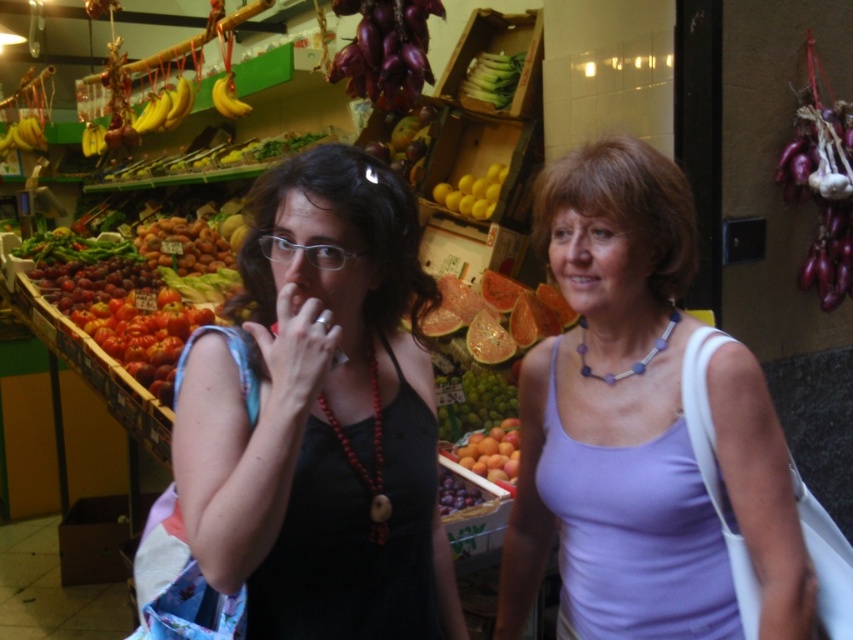
Question: Which of the following is the farthest from the observer?

Choices:
 (A) (218, 88)
 (B) (444, 182)
 (C) (479, 81)

Answer: (A)

Question: Does matte black tank top at center appear under smooth orange peaches at center?

Choices:
 (A) yes
 (B) no

Answer: (B)

Question: Can you confirm if ripe yellow apricots at center is bigger than matte yellow bananas at left?

Choices:
 (A) yes
 (B) no

Answer: (A)

Question: Does purple glossy eggplant at upper center lie in front of yellow matte bananas at upper left?

Choices:
 (A) yes
 (B) no

Answer: (A)

Question: Among these points, which one is nearest to the camera?

Choices:
 (A) (347, 630)
 (B) (848, 230)
 (C) (216, 97)
 (D) (222, 262)

Answer: (A)

Question: Which point appears closest to the camera in this image?

Choices:
 (A) (x=22, y=144)
 (B) (x=109, y=307)
 (C) (x=636, y=534)
 (D) (x=503, y=436)

Answer: (C)